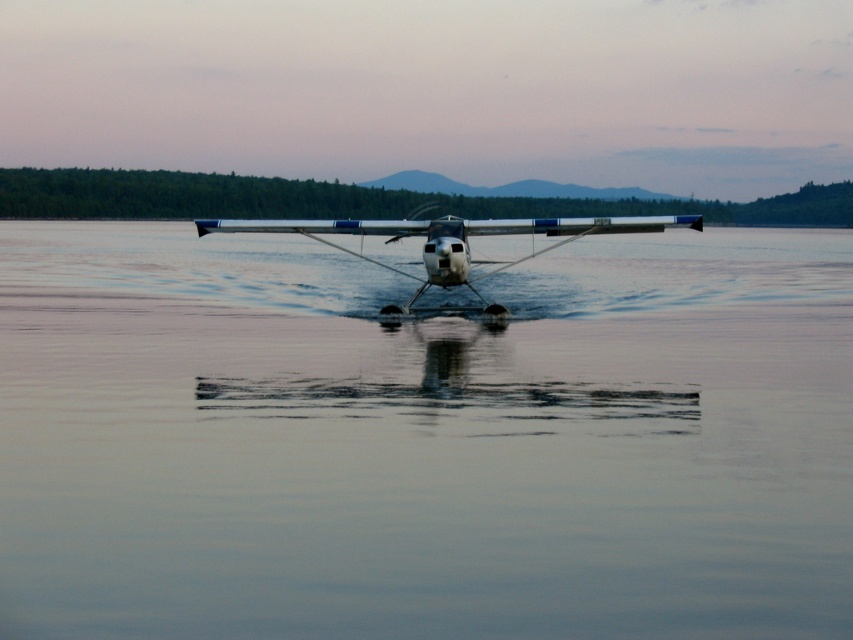
You are a pilot preparing to take off from the water. The seaplane requires a minimum of 10 meters of clear water surface directly in front of it to safely accelerate and lift off. Based on the scene, can the white glossy seaplane at center safely take off from the smooth water at center?

The smooth water at center is 12.11 meters from the white glossy seaplane at center. Since the required minimum distance is 10 meters, the white glossy seaplane at center has enough space to safely take off from the smooth water at center.

You are a pilot planning to land a seaplane. You observe the smooth water at center and the white glossy seaplane at center in the image. Which surface is more suitable for landing based on their sizes?

The smooth water at center has a larger size compared to the white glossy seaplane at center, so the smooth water at center is more suitable for landing as it provides a wider and safer area for the seaplane to touch down.

You are a pilot who just landed the white glossy seaplane at center on the smooth water at center. Can you see the reflection of the seaplane in the water?

The smooth water at center is in front of the white glossy seaplane at center, so the reflection of the white glossy seaplane at center would be visible on the smooth water at center since calm water typically reflects objects above it.